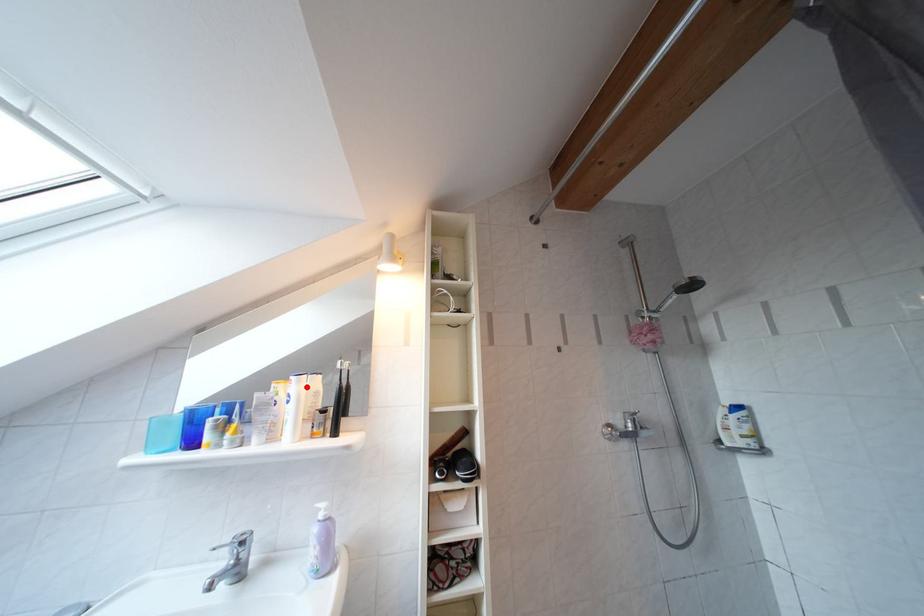
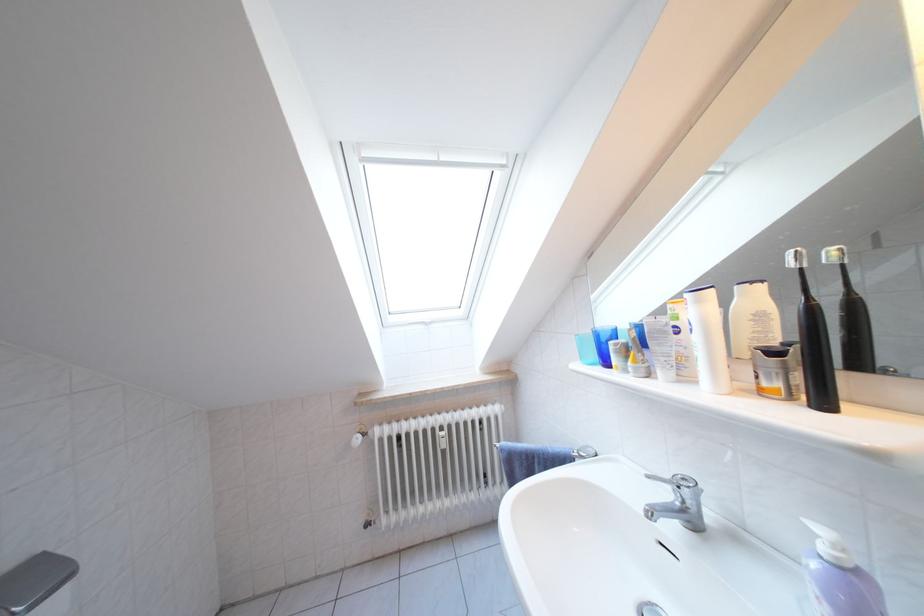
Find the pixel in the second image that matches the highlighted location in the first image.

(708, 306)